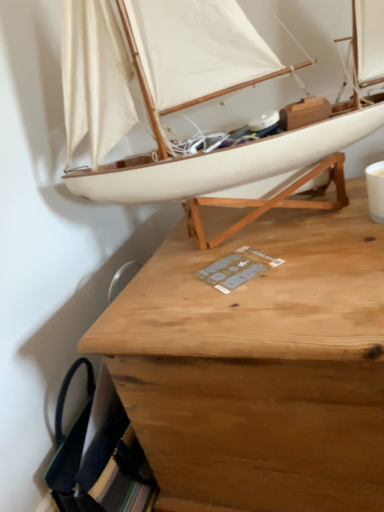
Question: Is point (220, 355) closer or farther from the camera than point (175, 194)?

Choices:
 (A) farther
 (B) closer

Answer: (B)

Question: Considering the positions of wooden desk at center and white matte sailboat at upper center in the image, is wooden desk at center taller or shorter than white matte sailboat at upper center?

Choices:
 (A) short
 (B) tall

Answer: (B)

Question: Is wooden desk at center in front of or behind white matte sailboat at upper center in the image?

Choices:
 (A) behind
 (B) front

Answer: (A)

Question: From the image's perspective, relative to wooden desk at center, is white matte sailboat at upper center above or below?

Choices:
 (A) below
 (B) above

Answer: (B)

Question: From a real-world perspective, is white matte sailboat at upper center above or below wooden desk at center?

Choices:
 (A) below
 (B) above

Answer: (B)

Question: Considering the positions of white matte sailboat at upper center and wooden desk at center in the image, is white matte sailboat at upper center bigger or smaller than wooden desk at center?

Choices:
 (A) small
 (B) big

Answer: (A)

Question: Is white matte sailboat at upper center taller or shorter than wooden desk at center?

Choices:
 (A) short
 (B) tall

Answer: (A)